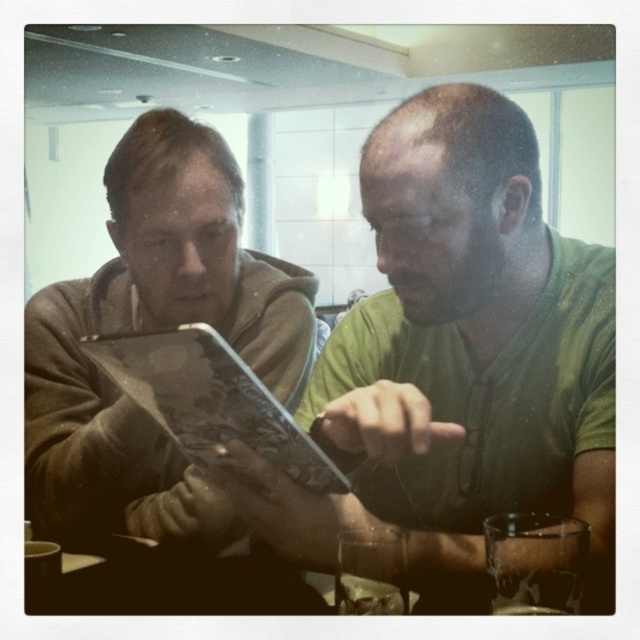
Question: Does green matte shirt at center appear over matte black tablet at center?

Choices:
 (A) no
 (B) yes

Answer: (B)

Question: Is matte brown hoodie at left to the left of matte black tablet at center from the viewer's perspective?

Choices:
 (A) yes
 (B) no

Answer: (A)

Question: Which object is farther from the camera taking this photo?

Choices:
 (A) matte black tablet at center
 (B) green matte shirt at center

Answer: (B)

Question: Estimate the real-world distances between objects in this image. Which object is closer to the green matte shirt at center?

Choices:
 (A) matte black tablet at center
 (B) matte brown hoodie at left

Answer: (A)

Question: Which of the following is the farthest from the observer?

Choices:
 (A) green matte shirt at center
 (B) matte black tablet at center
 (C) matte brown hoodie at left

Answer: (C)

Question: From the image, what is the correct spatial relationship of green matte shirt at center in relation to matte black tablet at center?

Choices:
 (A) right
 (B) left

Answer: (A)